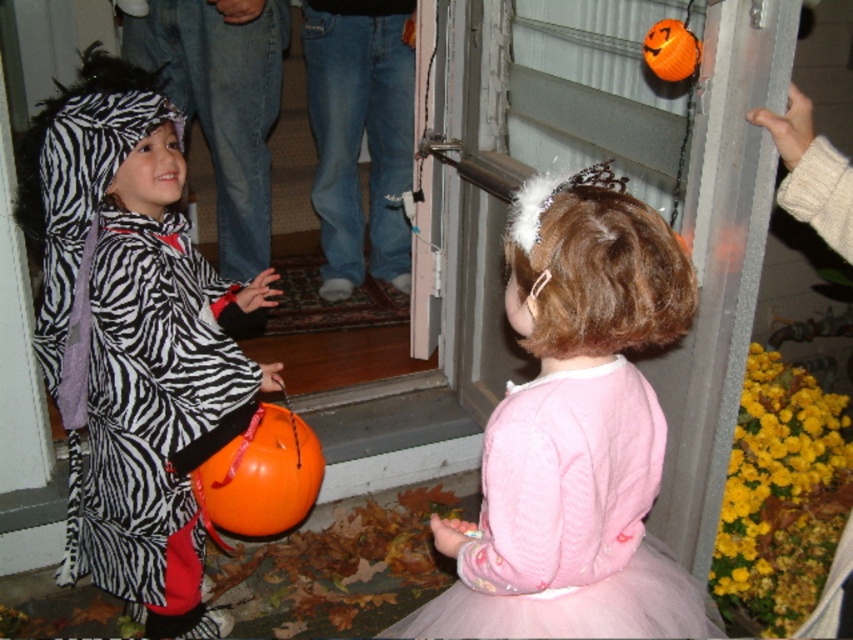
Is zebra print costume at left taller than orange matte pumpkin at lower left?

Indeed, zebra print costume at left has a greater height compared to orange matte pumpkin at lower left.

From the picture: Which is more to the right, zebra print costume at left or orange matte pumpkin at lower left?

orange matte pumpkin at lower left

Between point (173, 186) and point (277, 468), which one is positioned behind?

Positioned behind is point (173, 186).

I want to click on zebra print costume at left, so click(132, 337).

Is point (479, 584) positioned in front of point (256, 454)?

Yes.

Between point (459, 566) and point (316, 483), which one is positioned behind?

Positioned behind is point (316, 483).

This screenshot has width=853, height=640. In order to click on pink satin dress at center in this screenshot , I will do `click(573, 433)`.

Can you confirm if pink satin dress at center is positioned below orange matte pumpkin at upper right?

Correct, pink satin dress at center is located below orange matte pumpkin at upper right.

This screenshot has height=640, width=853. What do you see at coordinates (573, 433) in the screenshot?
I see `pink satin dress at center` at bounding box center [573, 433].

Where is `pink satin dress at center`? This screenshot has width=853, height=640. pink satin dress at center is located at coordinates (573, 433).